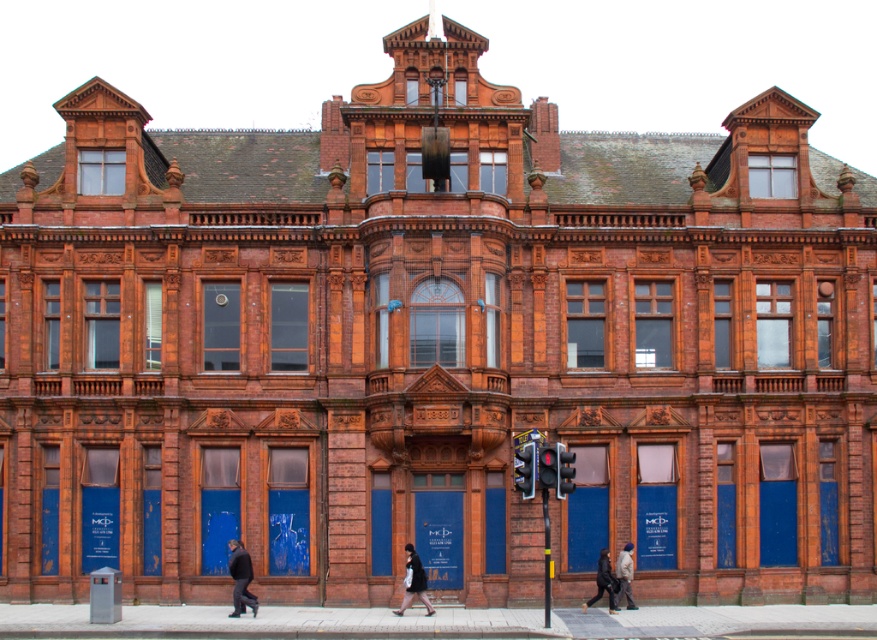
You are a delivery person trying to navigate through the street in front of the Victorian building. You see a dark gray fabric jacket at lower left and a black fabric coat at center. Which clothing item is narrower?

The dark gray fabric jacket at lower left has a lesser width compared to the black fabric coat at center, so the dark gray fabric jacket at lower left is narrower.

Based on the photo, you are standing in front of the Victorian building and want to take a photo. You notice two points marked on the ground at coordinates point (236,576) and point (415,573). Which point is closer to your camera position?

Point (236,576) is further to the camera than point (415,573), so the closer point to the camera is point (415,573).

You are a delivery person trying to place a large package between the black fabric coat at center and the dark gray fabric coat at lower center. Can you fit the package there if the package is 1.2 meters wide?

The black fabric coat at center might be wider than the dark gray fabric coat at lower center, so the space between them may be insufficient for a 1.2 meter wide package. It is uncertain and requires measuring.